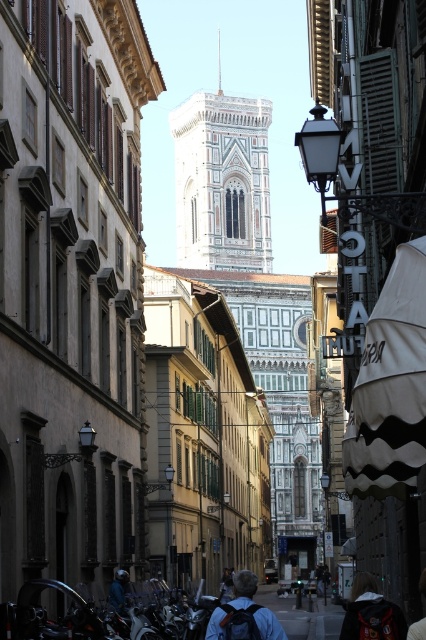
You are standing at the point with coordinates (391, 385) in the image. What object is located at your current position?

The white striped fabric umbrella at center right is located at point (391, 385).